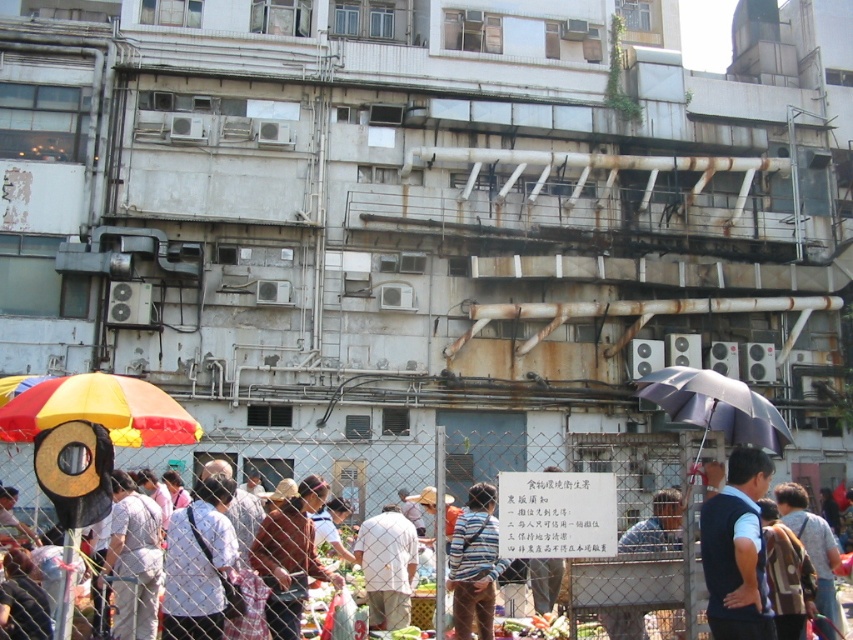
Question: Does dark blue vest at center appear on the left side of white matte shirt at center?

Choices:
 (A) yes
 (B) no

Answer: (B)

Question: Which point is farther to the camera?

Choices:
 (A) white woven shirt at center
 (B) dark purple fabric umbrella at right
 (C) dark blue vest at center

Answer: (A)

Question: Is dark blue vest at center positioned behind white cotton shirt at center?

Choices:
 (A) yes
 (B) no

Answer: (B)

Question: Considering the relative positions of dark purple fabric umbrella at right and striped shirt at center in the image provided, where is dark purple fabric umbrella at right located with respect to striped shirt at center?

Choices:
 (A) below
 (B) above

Answer: (B)

Question: Which of these objects is positioned closest to the yellow and red striped umbrella at left?

Choices:
 (A) white woven shirt at center
 (B) striped shirt at center
 (C) white matte shirt at center

Answer: (C)

Question: Which is nearer to the dark purple fabric umbrella at right?

Choices:
 (A) brown straw hat at center
 (B) white cotton shirt at center
 (C) white matte shirt at center

Answer: (A)